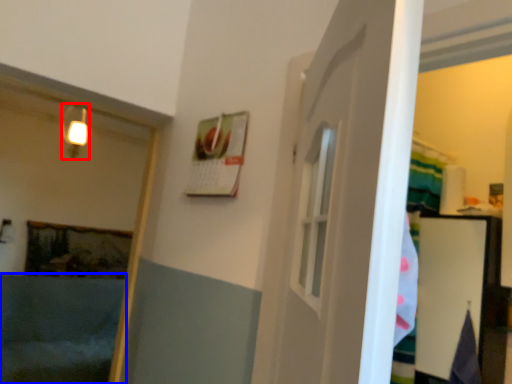
Question: Which object is closer to the camera taking this photo, light fixture (highlighted by a red box) or bath (highlighted by a blue box)?

Choices:
 (A) light fixture
 (B) bath

Answer: (B)